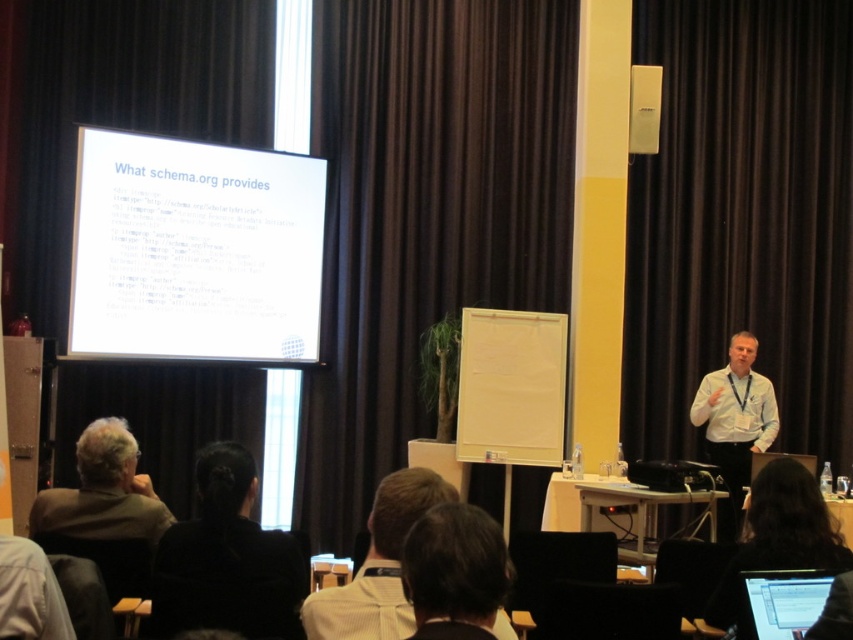
Question: Which point is closer to the camera taking this photo?

Choices:
 (A) (741, 426)
 (B) (375, 582)

Answer: (B)

Question: Which object appears closest to the camera in this image?

Choices:
 (A) black fabric hair at lower center
 (B) white paper at upper center

Answer: (A)

Question: From the image, what is the correct spatial relationship of white paperboard at center in relation to matte black laptop at lower right?

Choices:
 (A) right
 (B) left

Answer: (B)

Question: Is brown fabric curtain at upper center further to the viewer compared to white paperboard at center?

Choices:
 (A) yes
 (B) no

Answer: (A)

Question: Can you confirm if brown fabric curtain at upper center is positioned to the right of matte black laptop at lower right?

Choices:
 (A) yes
 (B) no

Answer: (B)

Question: Estimate the real-world distances between objects in this image. Which object is farther from the light brown shirt at center?

Choices:
 (A) brown fabric curtain at upper center
 (B) black fabric hair at lower center
 (C) black fabric laptop at lower right

Answer: (A)